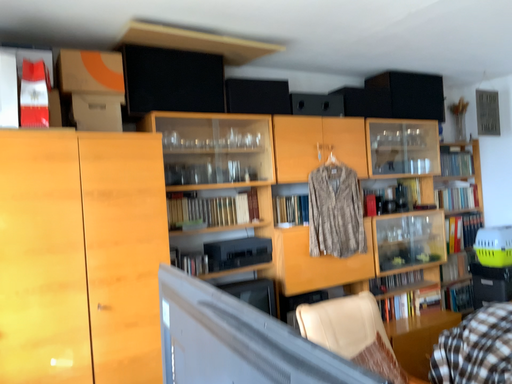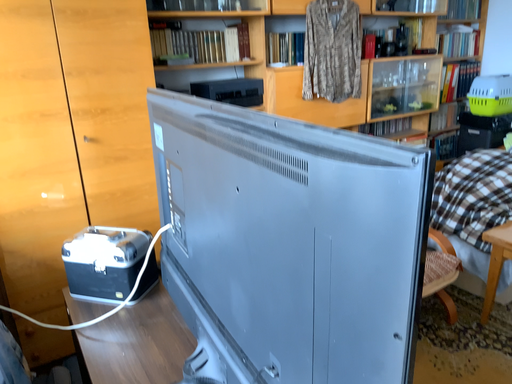
Question: Which way did the camera rotate in the video?

Choices:
 (A) rotated downward
 (B) rotated upward

Answer: (A)